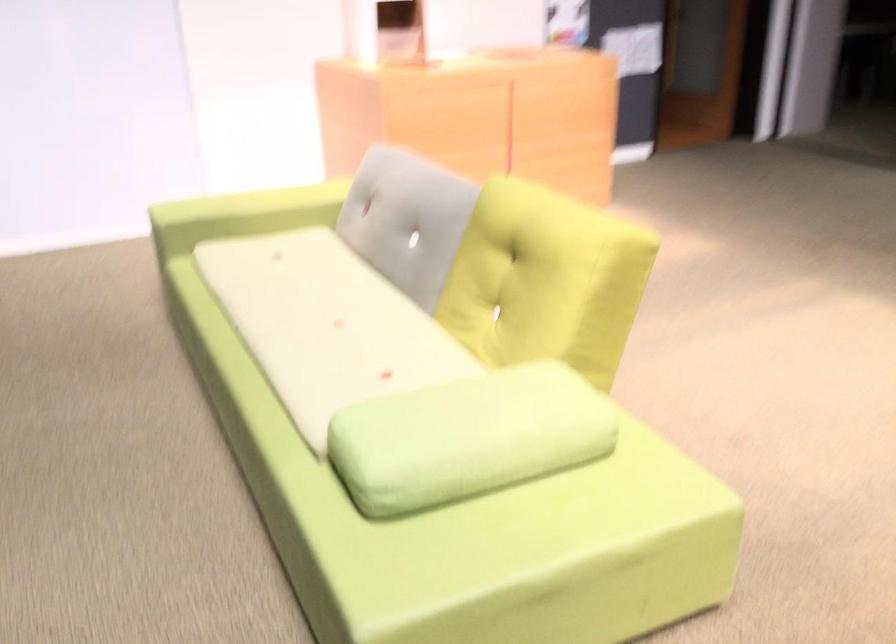
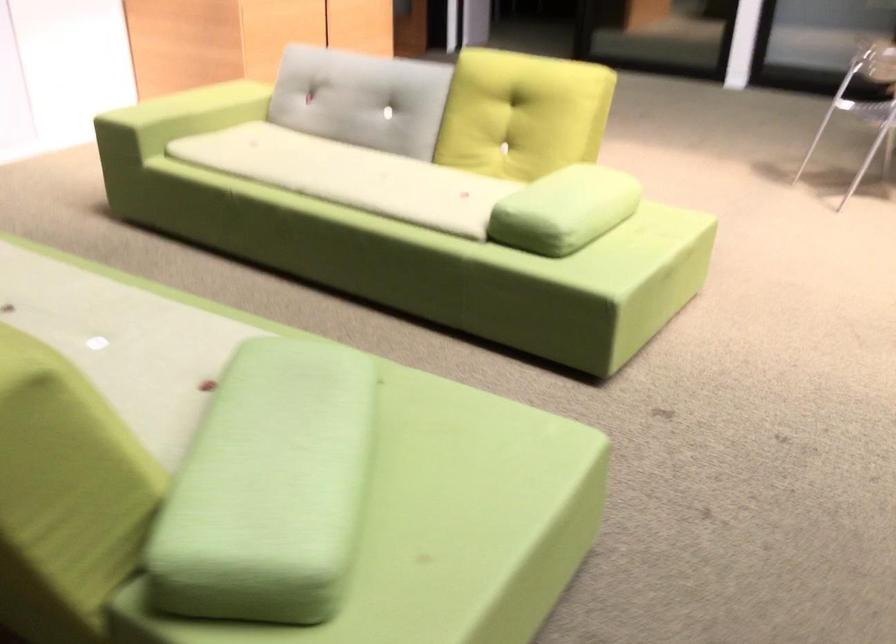
In the second image, find the point that corresponds to [291,322] in the first image.

(349, 176)